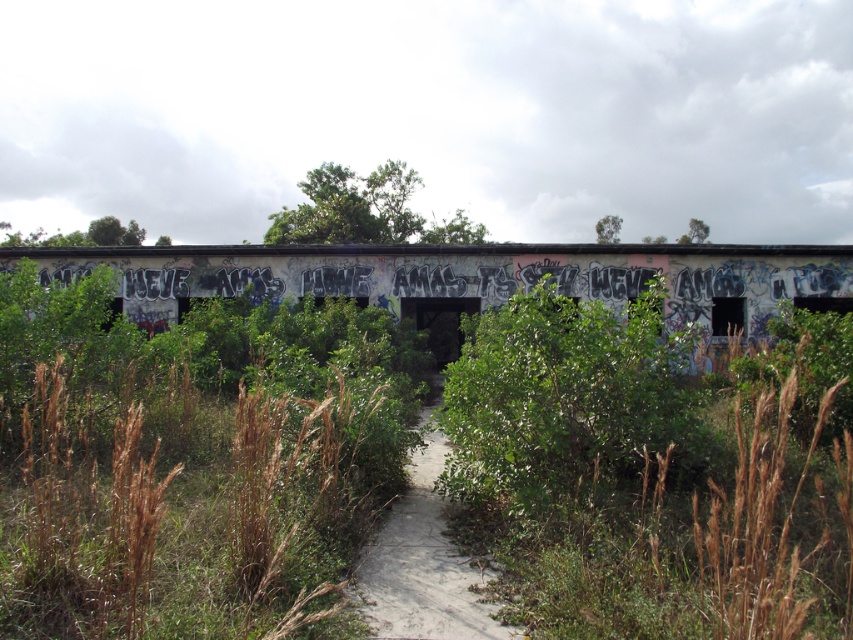
You are a hiker trying to cross the area shown in the image. You see a grungy concrete bridge at center and a dirt path at center. Which one is higher from the ground?

The grungy concrete bridge at center is higher compared to the dirt path at center.

You are a hiker carrying a heavy backpack and need to cross the area shown. You see the grungy concrete bridge at center and the dirt path at center. Which path is closer to you?

The dirt path at center is closer to you because the grungy concrete bridge at center is 12.23 meters away from it, implying that one of them is farther. Since the question asks which is closer, without knowing your exact position, but based on the given distance between them, if you are equidistant, but the bridge is 12 meters away from the path, the path itself would naturally be closer if you are on the path. However, the description says the bridge is 12.23 meters from the path, so the path is at 0 and

You are standing at the point closer to the camera in this scene. Which point are you at, point (830, 304) or point (403, 552)?

You are at point (830, 304) because it is further to the camera than point (403, 552).